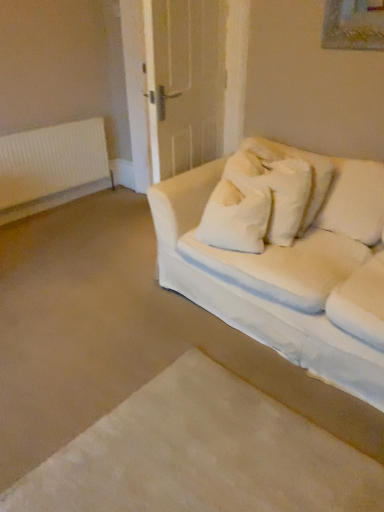
Find the location of a particular element. vacant space underneath white plastic radiator at left (from a real-world perspective) is located at coordinates tap(67, 204).